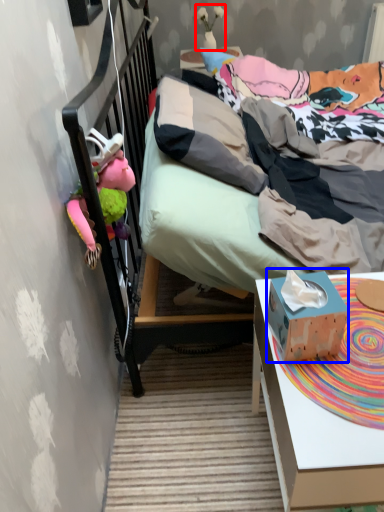
Question: Which of the following is the closest to the observer, toy (highlighted by a red box) or box (highlighted by a blue box)?

Choices:
 (A) toy
 (B) box

Answer: (B)